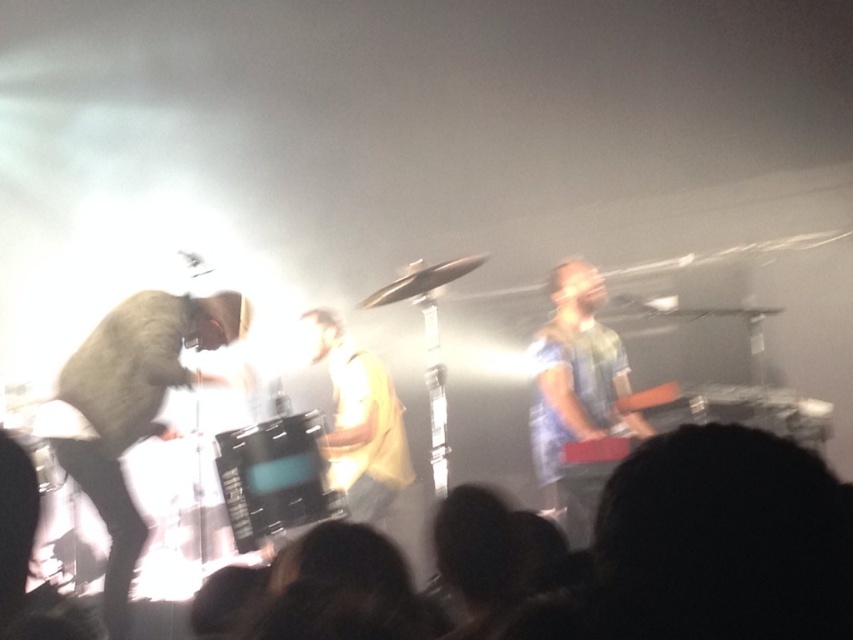
Question: Which point appears farthest from the camera in this image?

Choices:
 (A) (738, 595)
 (B) (579, 372)

Answer: (B)

Question: Which object appears closest to the camera in this image?

Choices:
 (A) light brown leather jacket at left
 (B) denim shirt at right
 (C) black hair at lower center

Answer: (C)

Question: Estimate the real-world distances between objects in this image. Which object is closer to the denim shirt at right?

Choices:
 (A) light brown leather jacket at left
 (B) black hair at lower center

Answer: (A)

Question: Where is light brown leather jacket at left located in relation to denim shirt at right in the image?

Choices:
 (A) left
 (B) right

Answer: (A)

Question: Is black hair at lower center further to camera compared to light brown leather jacket at left?

Choices:
 (A) yes
 (B) no

Answer: (B)

Question: Is light brown leather jacket at left thinner than denim shirt at right?

Choices:
 (A) no
 (B) yes

Answer: (A)